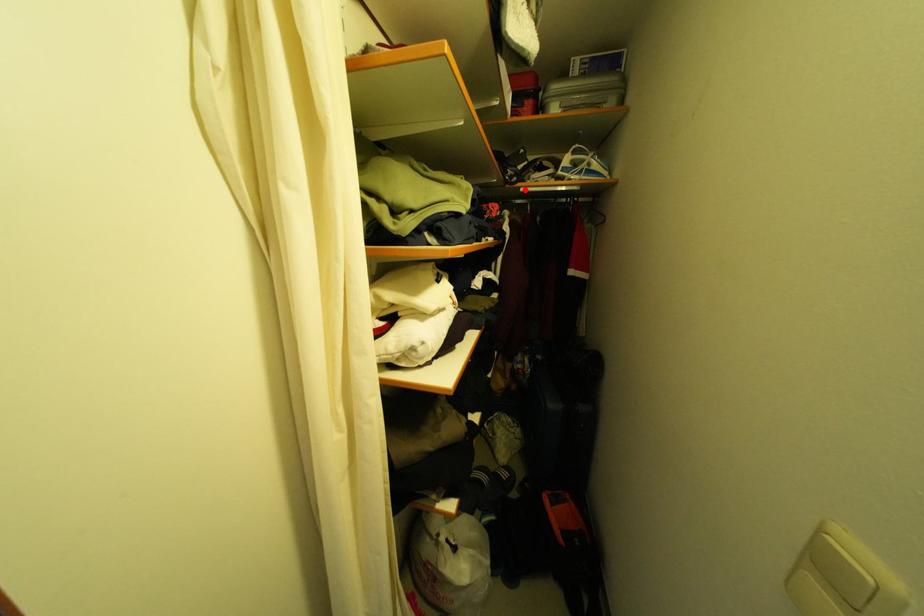
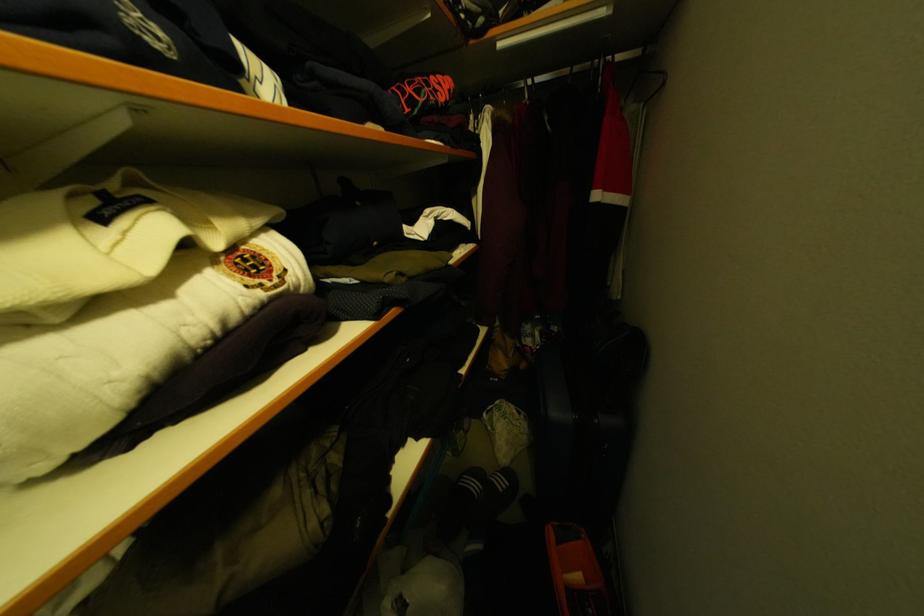
Find the pixel in the second image that matches the highlighted location in the first image.

(500, 43)